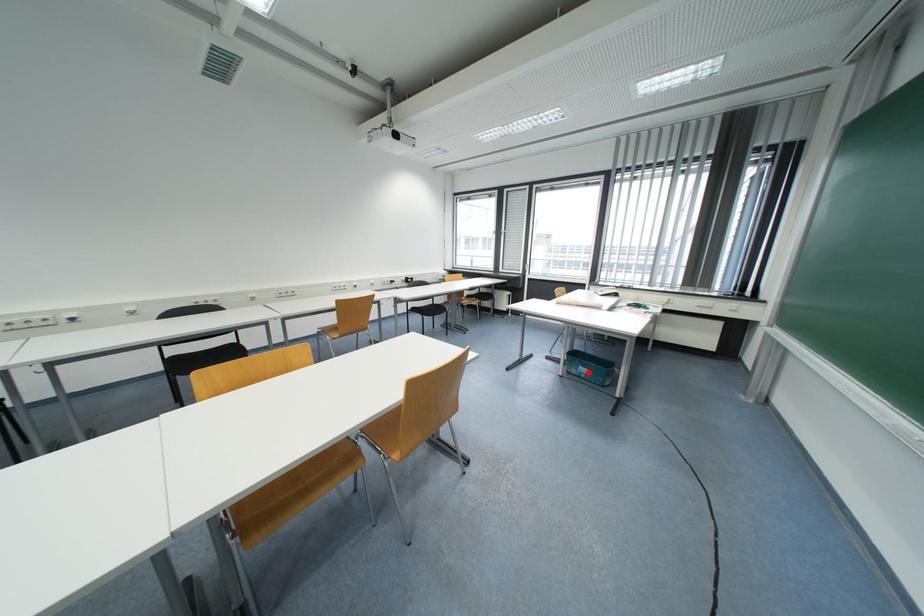
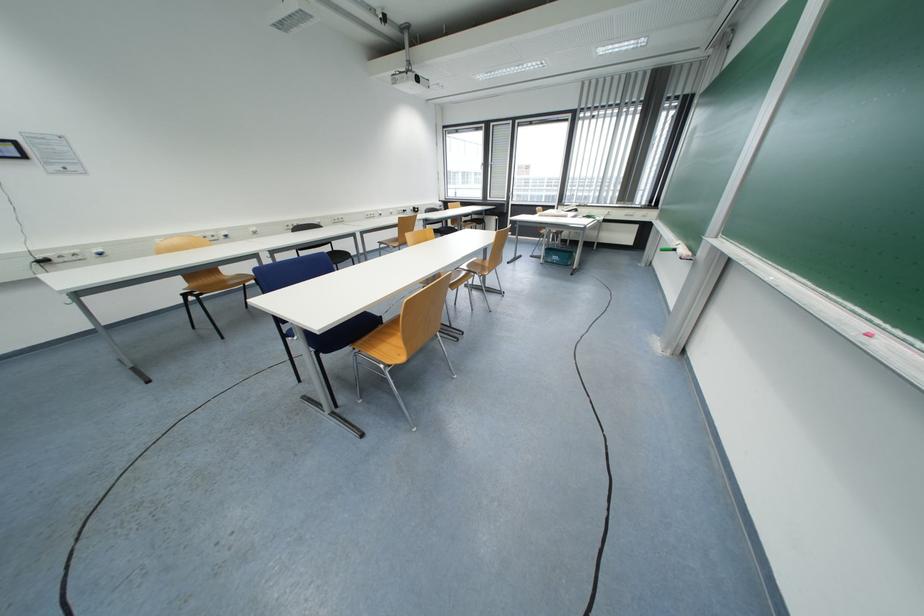
Question: I am providing you with two images of the same scene from different viewpoints. Given a red point in image1, look at the same physical point in image2. Is it:

Choices:
 (A) Closer to the viewpoint
 (B) Farther from the viewpoint

Answer: (A)